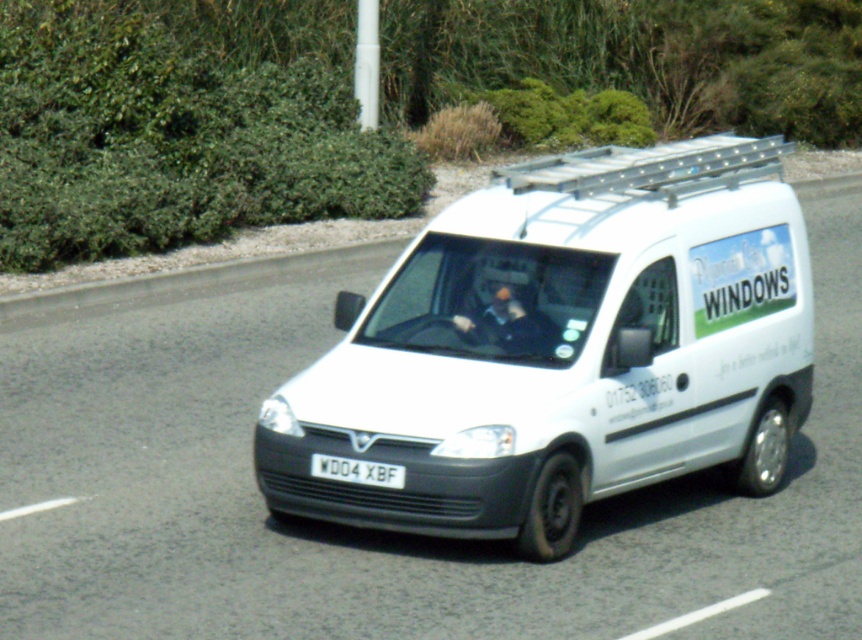
Which is in front, point (558, 280) or point (152, 220)?

Positioned in front is point (558, 280).

Which of these two, white matte van at center or green leafy hedge at upper left, stands shorter?

With less height is green leafy hedge at upper left.

Does point (631, 195) come closer to viewer compared to point (307, 128)?

Yes, point (631, 195) is in front of point (307, 128).

The image size is (862, 640). What are the coordinates of `white matte van at center` in the screenshot? It's located at (561, 348).

Can you confirm if green leafy hedge at upper left is positioned above white plastic license plate at center?

Yes, green leafy hedge at upper left is above white plastic license plate at center.

Is green leafy hedge at upper left bigger than white plastic license plate at center?

Indeed, green leafy hedge at upper left has a larger size compared to white plastic license plate at center.

Who is more forward, (x=286, y=177) or (x=400, y=467)?

Point (x=400, y=467) is more forward.

Identify the location of green leafy hedge at upper left. The height and width of the screenshot is (640, 862). (170, 140).

Between white matte van at center and white plastic license plate at center, which one appears on the left side from the viewer's perspective?

white plastic license plate at center is more to the left.

Who is more forward, (741, 452) or (319, 472)?

Point (319, 472)

Image resolution: width=862 pixels, height=640 pixels. In order to click on white matte van at center in this screenshot , I will do `click(561, 348)`.